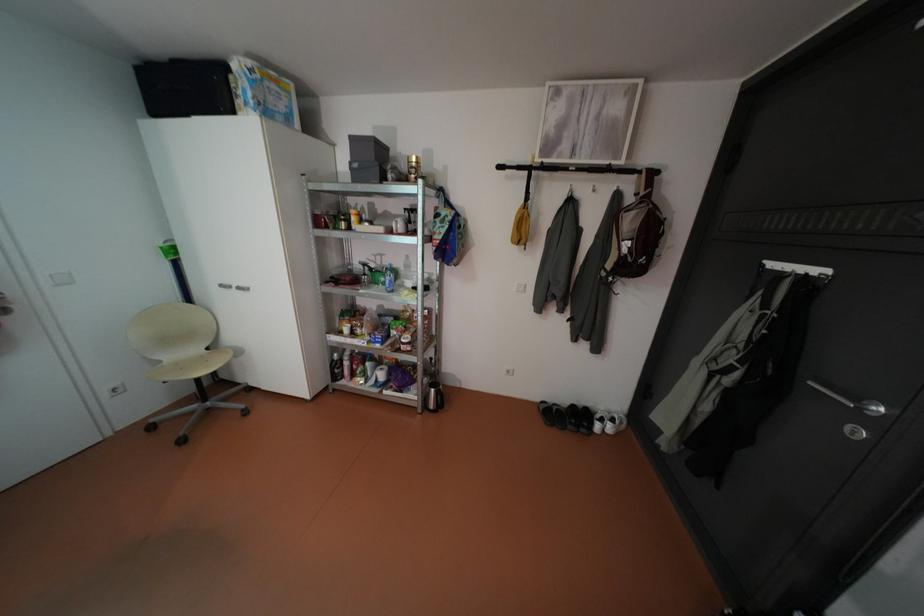
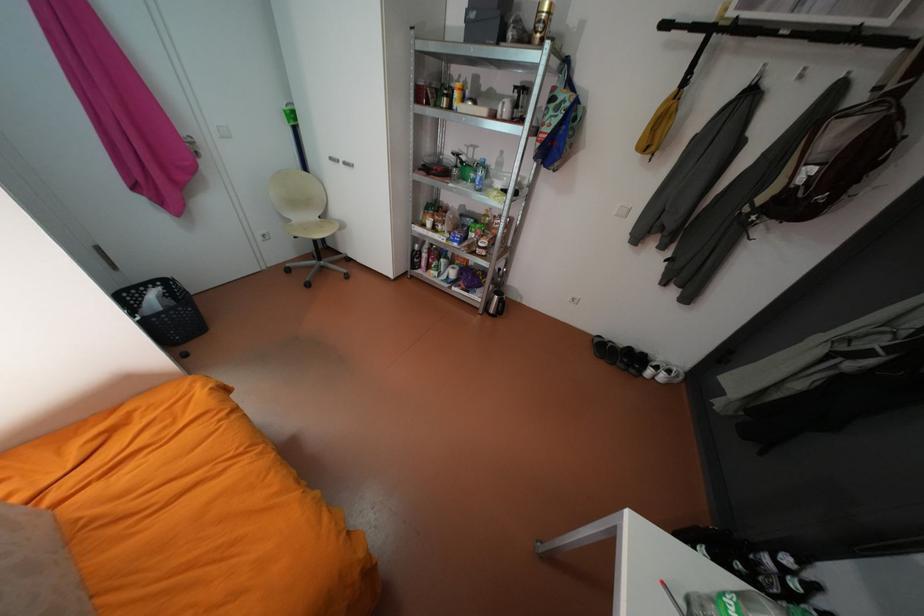
The point at (346, 376) is marked in the first image. Where is the corresponding point in the second image?

(423, 265)